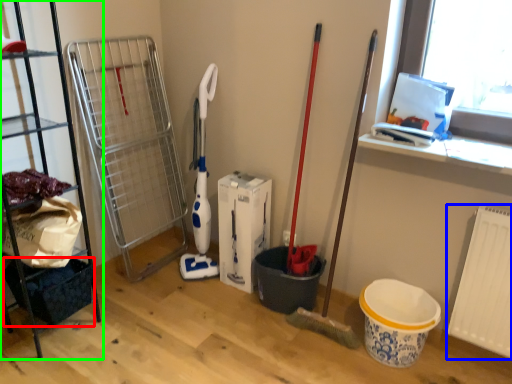
Question: Based on their relative distances, which object is farther from basket (highlighted by a red box)? Choose from radiator (highlighted by a blue box) and shelf (highlighted by a green box).

Choices:
 (A) radiator
 (B) shelf

Answer: (A)